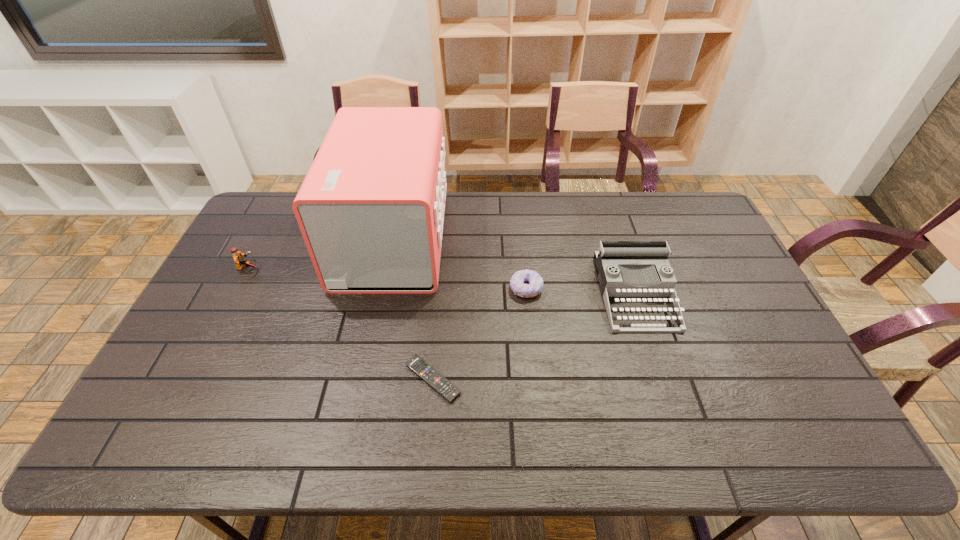
I want to click on box, so click(x=371, y=208).

Where is `the rightmost object`? the rightmost object is located at coordinates (616, 261).

The image size is (960, 540). I want to click on the fourth shortest object, so click(616, 261).

Locate an element on the screen. The width and height of the screenshot is (960, 540). the third tallest object is located at coordinates (238, 258).

You are a GUI agent. You are given a task and a screenshot of the screen. Output one action in this format:
    pyautogui.click(x=<x>, y=<y>)
    Task: Click on the leftmost object
    Image resolution: width=960 pixels, height=540 pixels.
    Given the screenshot: What is the action you would take?
    pyautogui.click(x=238, y=258)

The height and width of the screenshot is (540, 960). Identify the location of doughnut. (517, 281).

Locate an element on the screen. This screenshot has height=540, width=960. the fourth object from left to right is located at coordinates (517, 281).

You are a GUI agent. You are given a task and a screenshot of the screen. Output one action in this format:
    pyautogui.click(x=<x>, y=<y>)
    Task: Click on the remote control
    
    Given the screenshot: What is the action you would take?
    pyautogui.click(x=449, y=391)

Identify the location of the shortest object. This screenshot has width=960, height=540. (449, 391).

Locate an element on the screen. free space located on the surface of the box where the text is embossed is located at coordinates (494, 238).